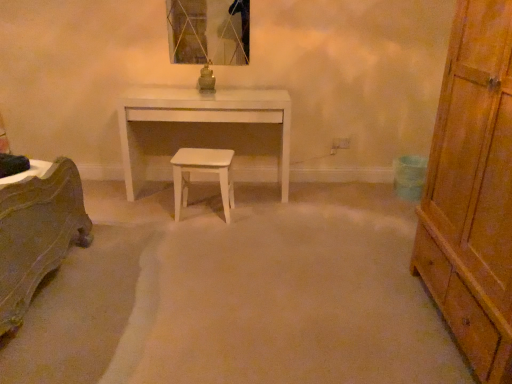
Locate an element on the screen. free location above white matte stool at center (from a real-world perspective) is located at coordinates (203, 152).